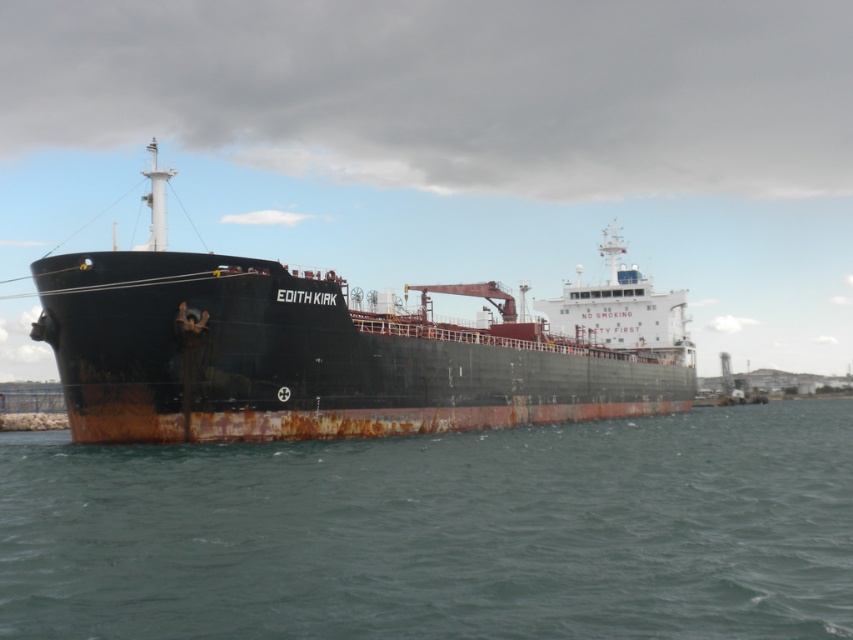
Question: Among these points, which one is nearest to the camera?

Choices:
 (A) (601, 596)
 (B) (572, 340)

Answer: (A)

Question: Can you confirm if rusty water at lower center is positioned to the right of rusty metal ship at center?

Choices:
 (A) no
 (B) yes

Answer: (B)

Question: Which of the following is the closest to the observer?

Choices:
 (A) rusty metal ship at center
 (B) rusty water at lower center

Answer: (B)

Question: Can you confirm if rusty water at lower center is positioned to the right of rusty metal ship at center?

Choices:
 (A) yes
 (B) no

Answer: (A)

Question: Considering the relative positions of rusty water at lower center and rusty metal ship at center in the image provided, where is rusty water at lower center located with respect to rusty metal ship at center?

Choices:
 (A) right
 (B) left

Answer: (A)